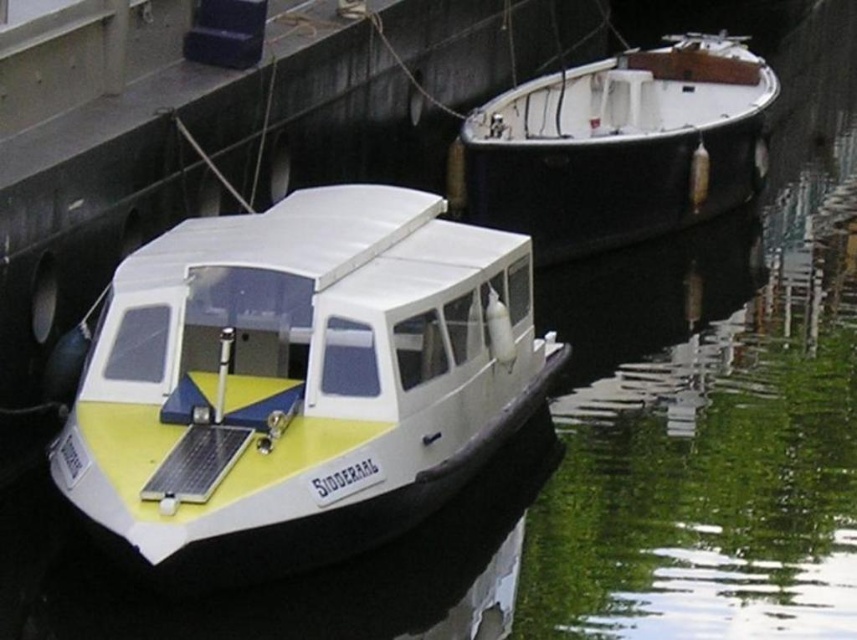
You are a sailor planning to dock your boat at the marina. You see the yellow matte boat at center and the black polished wood boat at upper right. Which boat is positioned lower in the image?

The yellow matte boat at center is positioned lower than the black polished wood boat at upper right in the image.